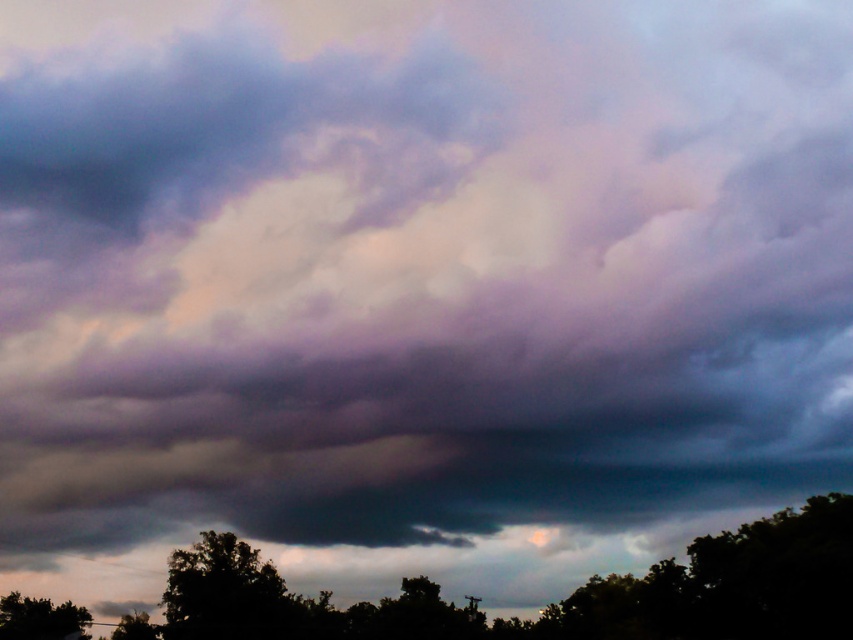
Consider the image. Does green leafy tree at lower center appear under green matte tree at lower left?

No, green leafy tree at lower center is not below green matte tree at lower left.

Based on the photo, does green leafy tree at lower center appear over green matte tree at lower left?

Correct, green leafy tree at lower center is located above green matte tree at lower left.

Locate an element on the screen. The height and width of the screenshot is (640, 853). green leafy tree at lower center is located at coordinates (550, 604).

Looking at this image, who is lower down, green leafy tree at lower center or silhouette leafy tree at lower center?

silhouette leafy tree at lower center is below.

Can you confirm if green leafy tree at lower center is positioned to the right of silhouette leafy tree at lower center?

Indeed, green leafy tree at lower center is positioned on the right side of silhouette leafy tree at lower center.

Between point (476, 620) and point (276, 589), which one is positioned in front?

Point (276, 589)

Locate an element on the screen. Image resolution: width=853 pixels, height=640 pixels. green leafy tree at lower center is located at coordinates (550, 604).

Is silhouette leafy tree at lower center behind green matte tree at lower left?

That is False.

Which is more to the left, silhouette leafy tree at lower center or green matte tree at lower left?

Positioned to the left is green matte tree at lower left.

Who is more forward, [193,593] or [61,616]?

Positioned in front is point [193,593].

Identify the location of silhouette leafy tree at lower center. The width and height of the screenshot is (853, 640). (x=227, y=593).